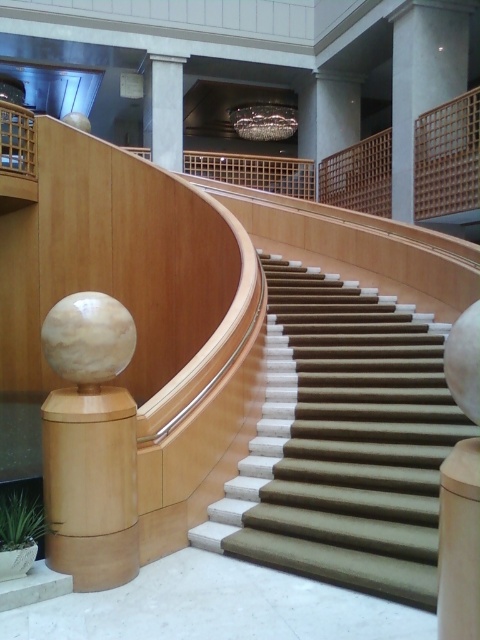
Who is more distant from viewer, [379,352] or [392,173]?

The point [392,173] is behind.

Between green carpeted stairs at center and smooth concrete pillar at upper center, which one has less height?

green carpeted stairs at center is shorter.

At what (x,y) coordinates should I click in order to perform the action: click on green carpeted stairs at center. Please return your answer as a coordinate pair (x, y). The height and width of the screenshot is (640, 480). Looking at the image, I should click on [x=343, y=442].

Is point (466, 461) closer to camera compared to point (181, 150)?

Yes, point (466, 461) is in front of point (181, 150).

Does wooden post at center appear over white marble column at upper center?

No, wooden post at center is not above white marble column at upper center.

Between point (468, 512) and point (158, 84), which one is positioned in front?

Positioned in front is point (468, 512).

This screenshot has height=640, width=480. In order to click on wooden post at center in this screenshot , I will do `click(458, 541)`.

Is green carpeted stairs at center thinner than white marble column at upper center?

No.

Identify the location of green carpeted stairs at center. (343, 442).